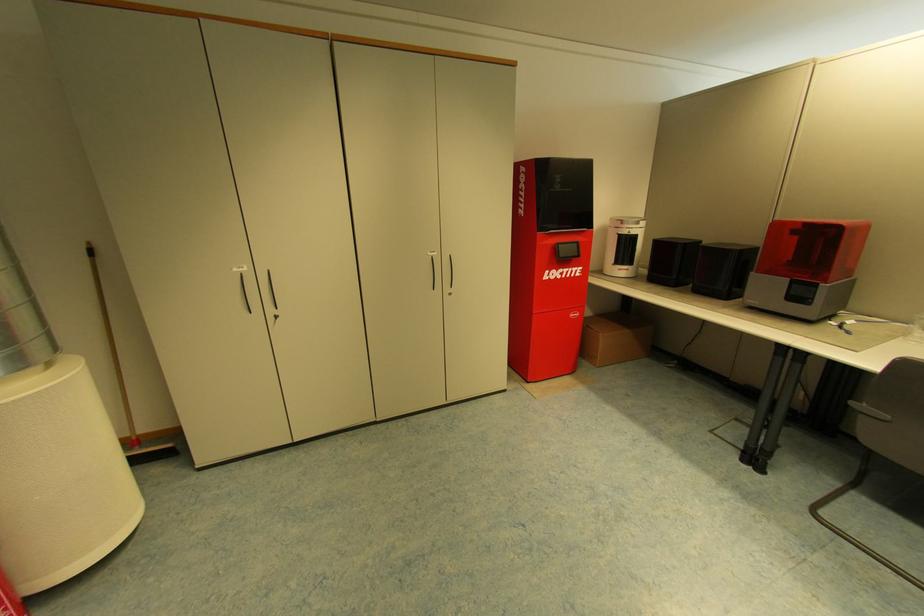
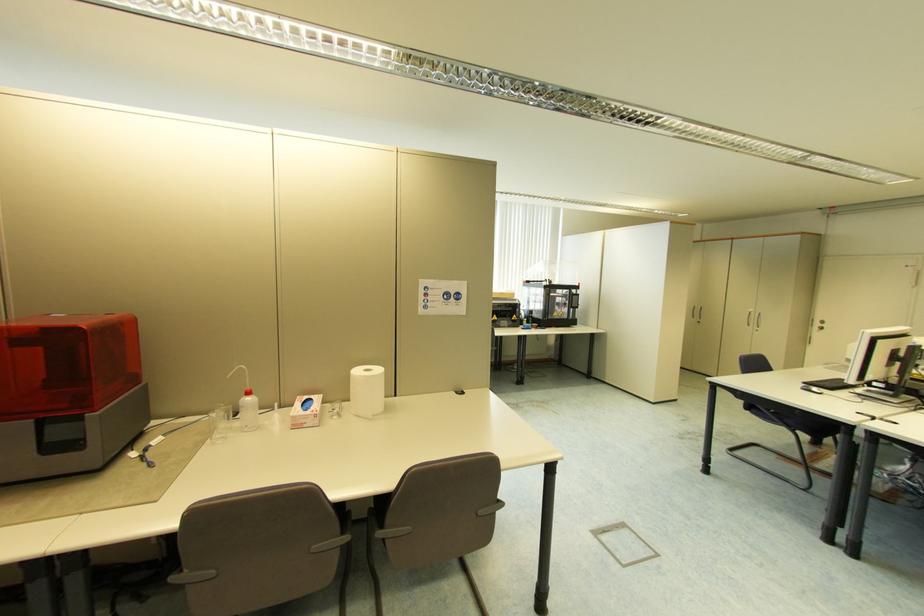
Find the pixel in the second image that matches point (853, 273) in the first image.

(139, 379)